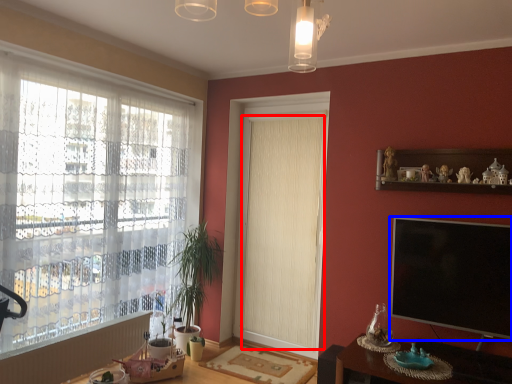
Question: Which point is further to the camera, curtain (highlighted by a red box) or television (highlighted by a blue box)?

Choices:
 (A) curtain
 (B) television

Answer: (A)